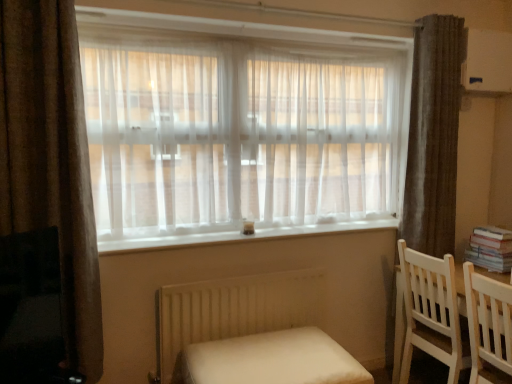
Image resolution: width=512 pixels, height=384 pixels. I want to click on vacant area on top of white smooth window sill at center (from a real-world perspective), so click(x=259, y=226).